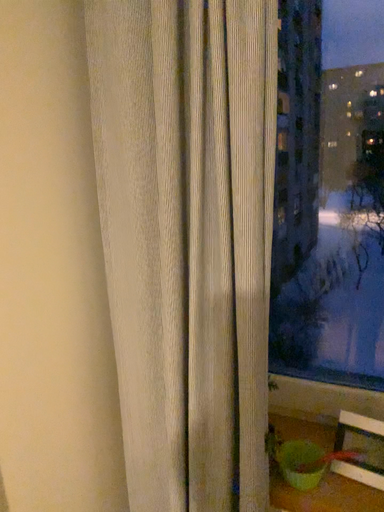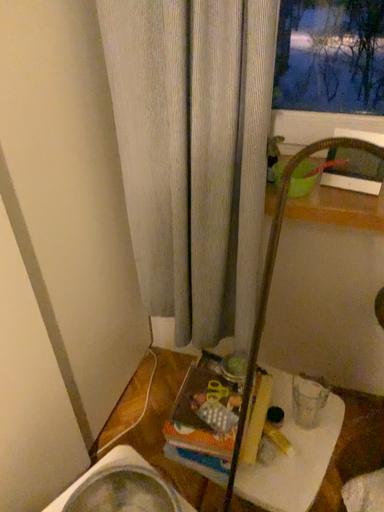
Question: Which way did the camera rotate in the video?

Choices:
 (A) rotated upward
 (B) rotated downward

Answer: (B)